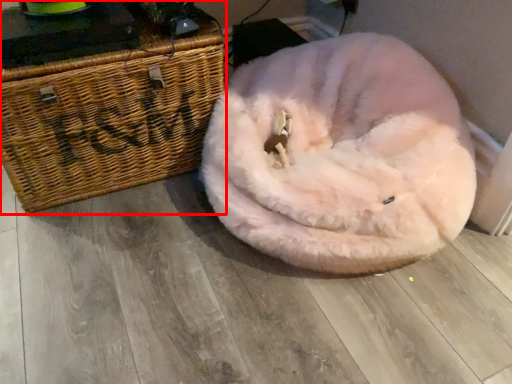
Question: Observing the image, what is the correct spatial positioning of furniture (annotated by the red box) in reference to dog bed?

Choices:
 (A) right
 (B) left

Answer: (B)